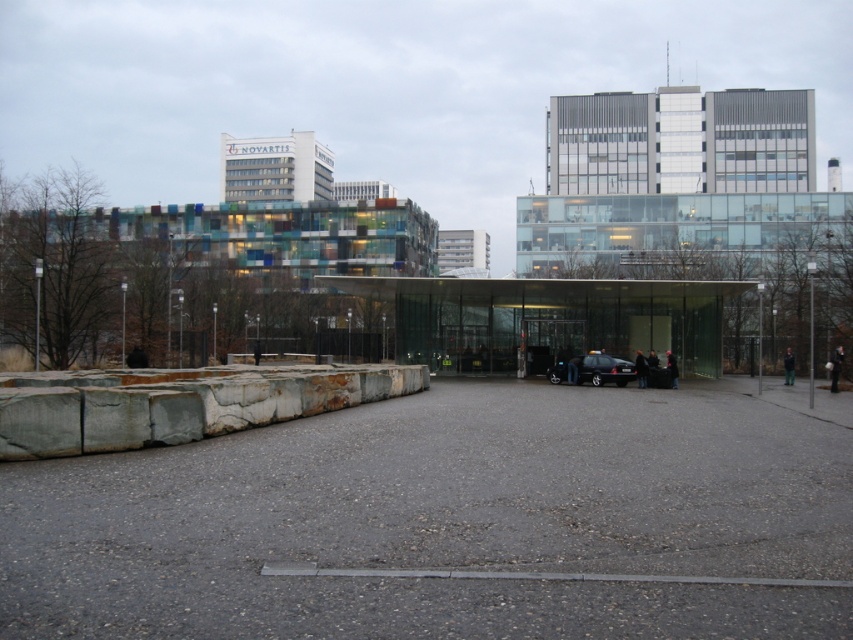
Question: Which object appears farthest from the camera in this image?

Choices:
 (A) black metallic car at center
 (B) gray asphalt parking lot at center

Answer: (A)

Question: Is gray asphalt parking lot at center thinner than black metallic car at center?

Choices:
 (A) no
 (B) yes

Answer: (A)

Question: Among these objects, which one is nearest to the camera?

Choices:
 (A) black metallic car at center
 (B) gray asphalt parking lot at center

Answer: (B)

Question: Among these objects, which one is nearest to the camera?

Choices:
 (A) black metallic car at center
 (B) gray asphalt parking lot at center

Answer: (B)

Question: Can you confirm if gray asphalt parking lot at center is smaller than black metallic car at center?

Choices:
 (A) no
 (B) yes

Answer: (A)

Question: Is gray asphalt parking lot at center behind black metallic car at center?

Choices:
 (A) no
 (B) yes

Answer: (A)